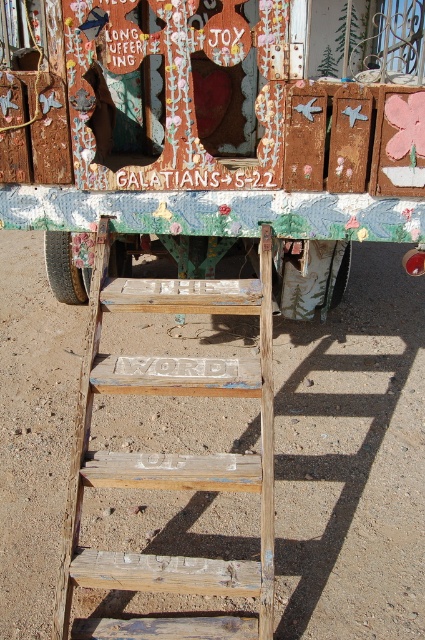
Question: Among these objects, which one is farthest from the camera?

Choices:
 (A) weathered wood ladder at center
 (B) rusty metal food truck at center
 (C) white painted wood at center

Answer: (C)

Question: Does rusty metal food truck at center appear on the left side of white painted wood at center?

Choices:
 (A) yes
 (B) no

Answer: (B)

Question: Which object appears farthest from the camera in this image?

Choices:
 (A) white painted wood at center
 (B) rusty metal food truck at center
 (C) weathered wood ladder at center

Answer: (A)

Question: Does weathered wood ladder at center have a smaller size compared to white painted wood at center?

Choices:
 (A) no
 (B) yes

Answer: (A)

Question: Is weathered wood ladder at center further to camera compared to white painted wood at center?

Choices:
 (A) yes
 (B) no

Answer: (B)

Question: Which point is closer to the camera?

Choices:
 (A) weathered wood ladder at center
 (B) white painted wood at center

Answer: (A)